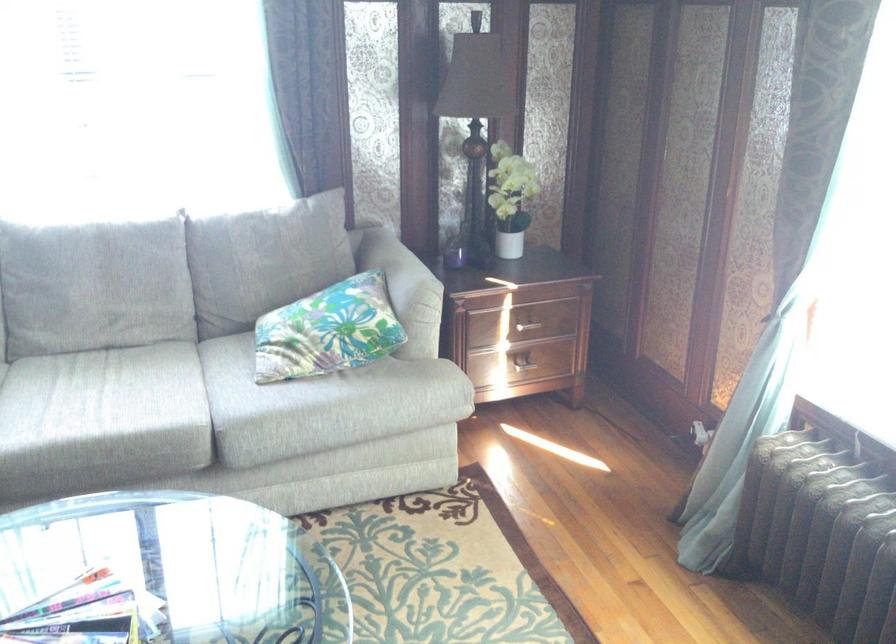
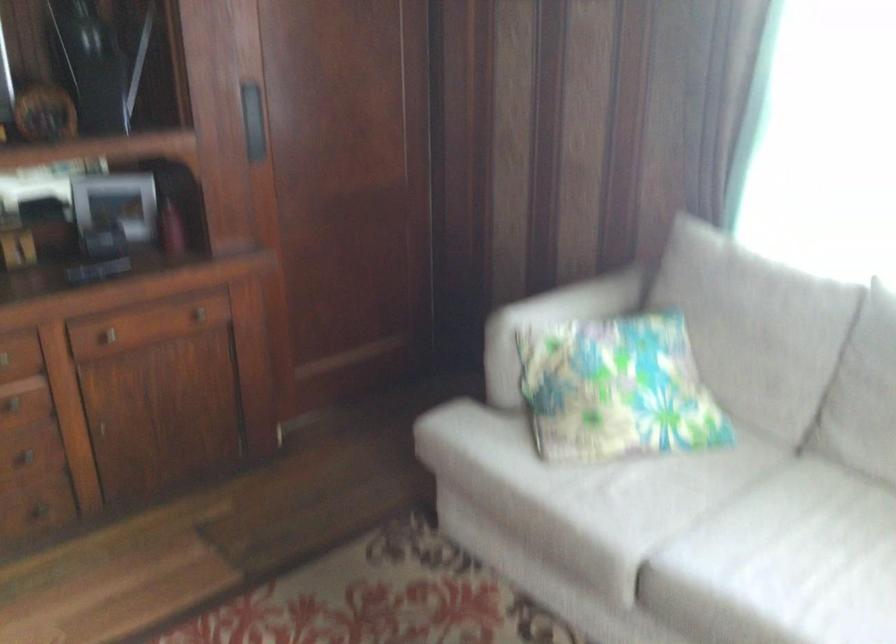
Question: The camera is either moving clockwise (left) or counter-clockwise (right) around the object. The first image is from the beginning of the video and the second image is from the end. Is the camera moving left or right when shooting the video?

Choices:
 (A) Left
 (B) Right

Answer: (B)